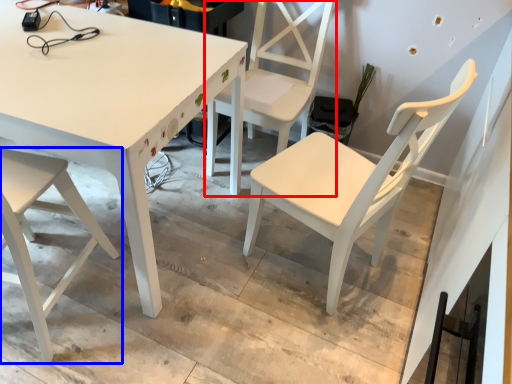
Question: Which of the following is the closest to the observer, chair (highlighted by a red box) or chair (highlighted by a blue box)?

Choices:
 (A) chair
 (B) chair

Answer: (B)